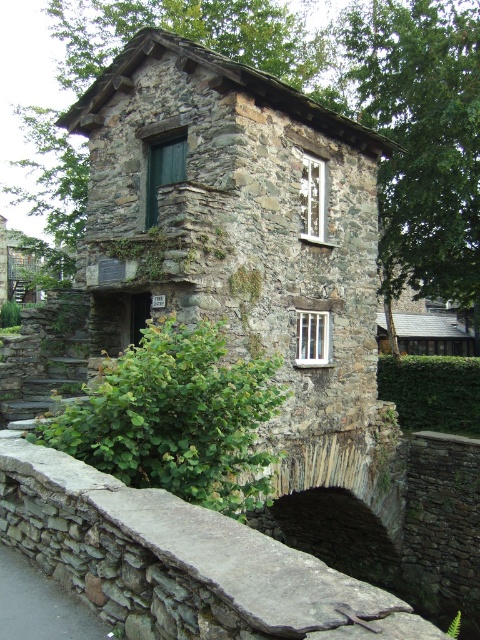
Can you confirm if gray stone ledge at center is positioned to the left of green leafy hedge at lower left?

Indeed, gray stone ledge at center is positioned on the left side of green leafy hedge at lower left.

Is gray stone ledge at center below green leafy hedge at lower left?

Yes, gray stone ledge at center is below green leafy hedge at lower left.

Does point (141, 577) come farther from viewer compared to point (133, 429)?

No.

Locate an element on the screen. gray stone ledge at center is located at coordinates (180, 561).

Which is below, gray stone ledge at center or green leafy hedge at lower center?

green leafy hedge at lower center is below.

Who is higher up, gray stone ledge at center or green leafy hedge at lower center?

gray stone ledge at center is above.

Does point (277, 564) come farther from viewer compared to point (447, 420)?

No, it is in front of (447, 420).

Identify the location of gray stone ledge at center. The height and width of the screenshot is (640, 480). (180, 561).

Is green leafy hedge at lower left below green leafy hedge at lower center?

Actually, green leafy hedge at lower left is above green leafy hedge at lower center.

This screenshot has height=640, width=480. I want to click on green leafy hedge at lower left, so tap(178, 419).

The width and height of the screenshot is (480, 640). In order to click on green leafy hedge at lower left in this screenshot , I will do `click(178, 419)`.